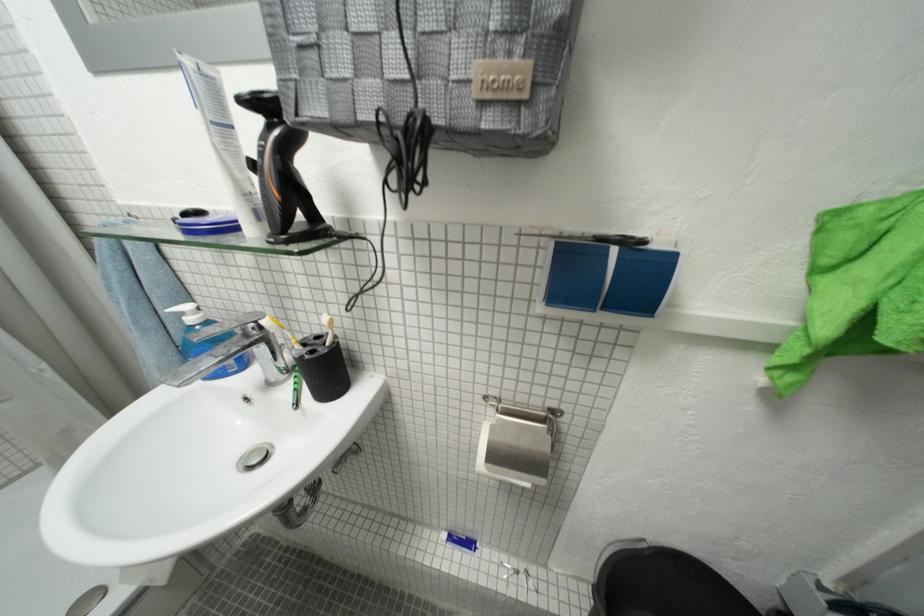
Where is `chrome faucet handle`? chrome faucet handle is located at coordinates (227, 323).